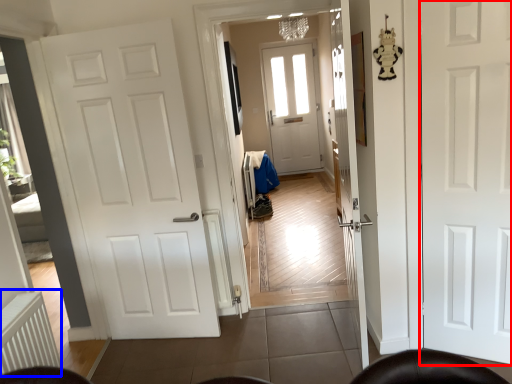
Question: Which point is closer to the camera, door (highlighted by a red box) or radiator (highlighted by a blue box)?

Choices:
 (A) door
 (B) radiator

Answer: (B)